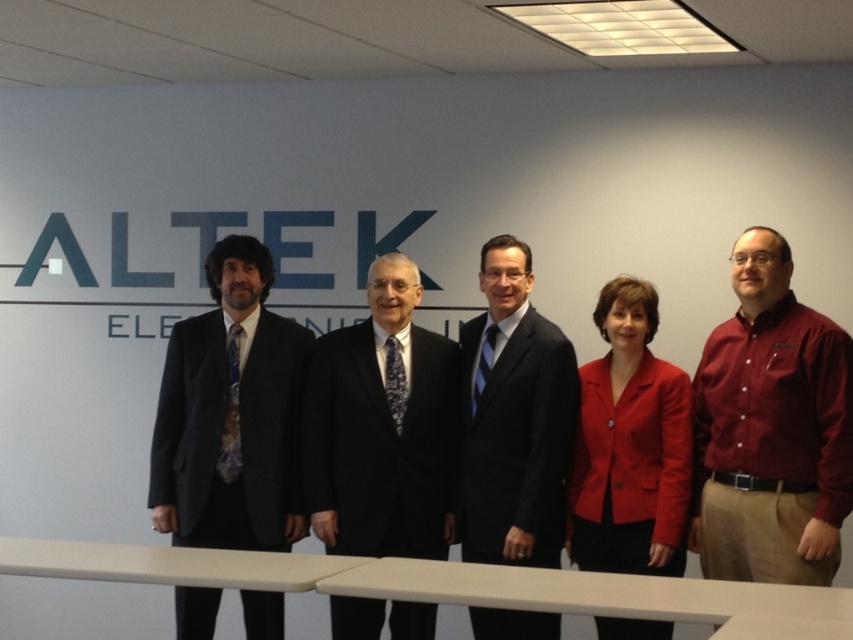
Question: Can you confirm if black wool suit at left is wider than red matte blazer at center?

Choices:
 (A) yes
 (B) no

Answer: (A)

Question: Considering the relative positions of maroon button-down shirt at right and red matte blazer at center in the image provided, where is maroon button-down shirt at right located with respect to red matte blazer at center?

Choices:
 (A) right
 (B) left

Answer: (A)

Question: Where is maroon button-down shirt at right located in relation to red matte blazer at center in the image?

Choices:
 (A) below
 (B) above

Answer: (B)

Question: Based on their relative distances, which object is farther from the black wool suit at center?

Choices:
 (A) black wool suit at left
 (B) black suit at center
 (C) red matte blazer at center

Answer: (C)

Question: Which point is closer to the camera?

Choices:
 (A) (785, 468)
 (B) (668, 460)
 (C) (264, 520)
 (D) (370, 337)

Answer: (A)

Question: Which object appears farthest from the camera in this image?

Choices:
 (A) black suit at center
 (B) black wool suit at center
 (C) black wool suit at left

Answer: (C)